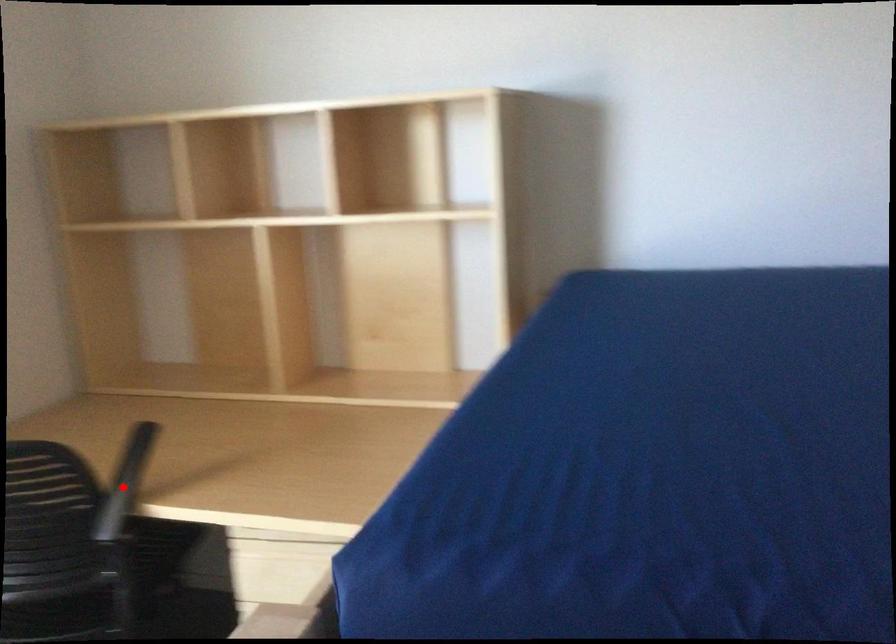
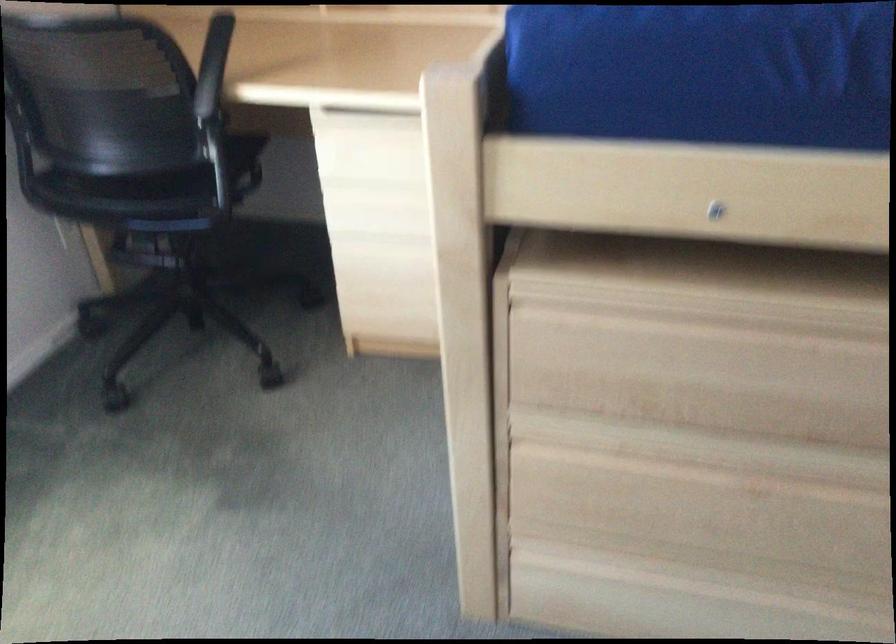
Where in the second image is the point corresponding to the highlighted location from the first image?

(212, 66)